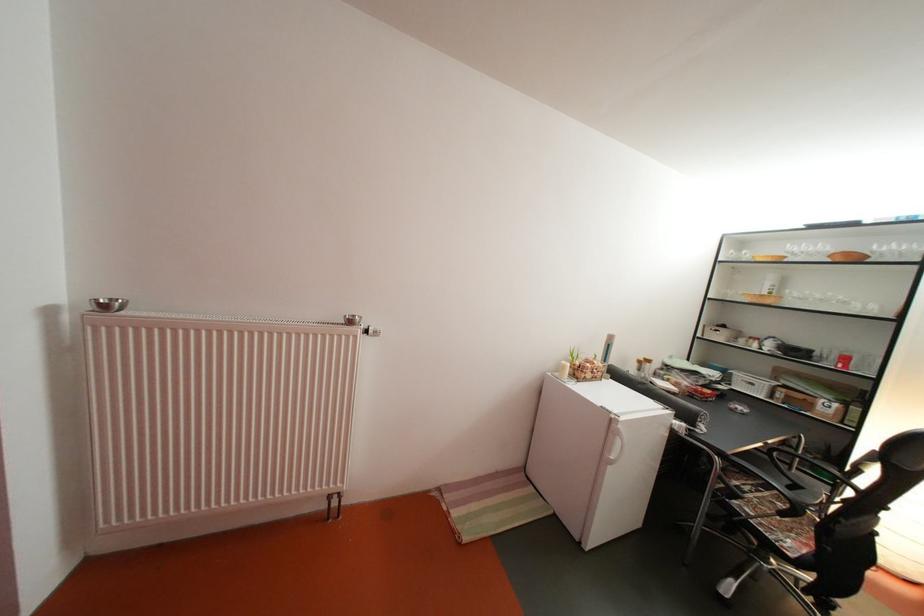
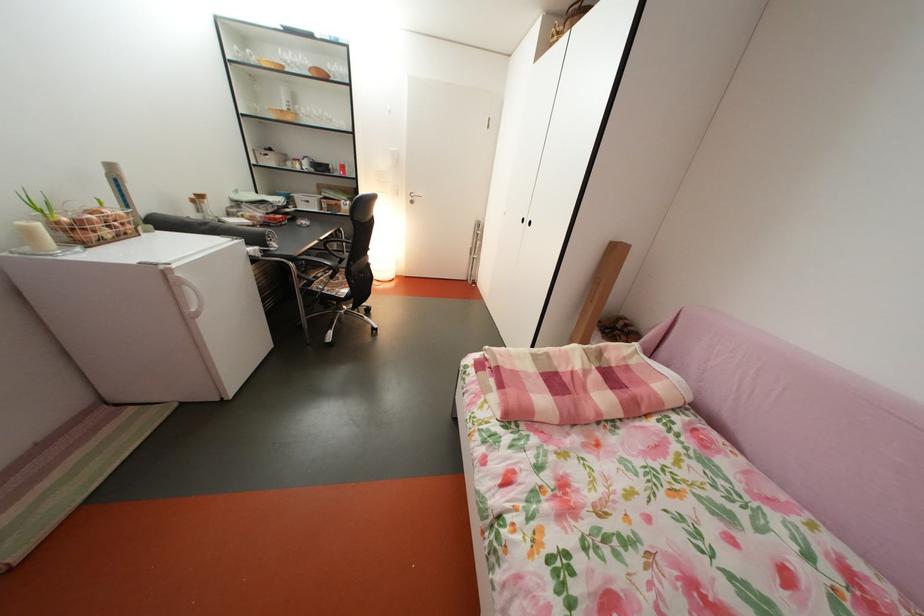
Where in the second image is the point corresponding to the point at 779,308 from the first image?

(300, 124)